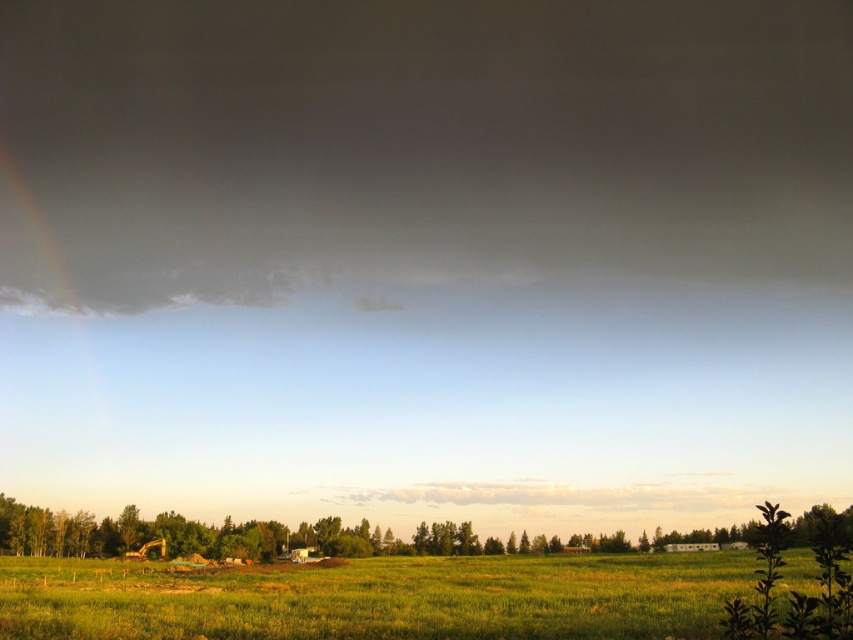
Question: Does dark gray cloud at upper center appear on the left side of green grassy field at lower center?

Choices:
 (A) no
 (B) yes

Answer: (A)

Question: Which object is positioned closest to the green grassy field at lower center?

Choices:
 (A) dark gray cloud at upper center
 (B) green leafy tree at lower left

Answer: (B)

Question: Which of these objects is positioned farthest from the green grassy field at lower center?

Choices:
 (A) green leafy tree at lower left
 (B) dark gray cloud at upper center

Answer: (B)

Question: Is dark gray cloud at upper center smaller than green grassy field at lower center?

Choices:
 (A) yes
 (B) no

Answer: (B)

Question: Which object is positioned closest to the green leafy tree at lower left?

Choices:
 (A) green grassy field at lower center
 (B) dark gray cloud at upper center

Answer: (A)

Question: Considering the relative positions of dark gray cloud at upper center and green leafy tree at lower left in the image provided, where is dark gray cloud at upper center located with respect to green leafy tree at lower left?

Choices:
 (A) right
 (B) left

Answer: (A)